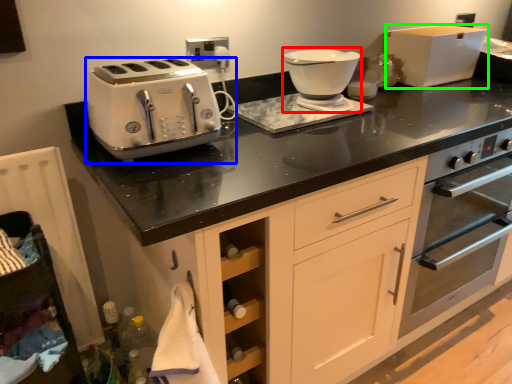
Question: Which object is the farthest from food processor (highlighted by a red box)? Choose among these: toaster (highlighted by a blue box) or kitchen appliance (highlighted by a green box).

Choices:
 (A) toaster
 (B) kitchen appliance

Answer: (B)